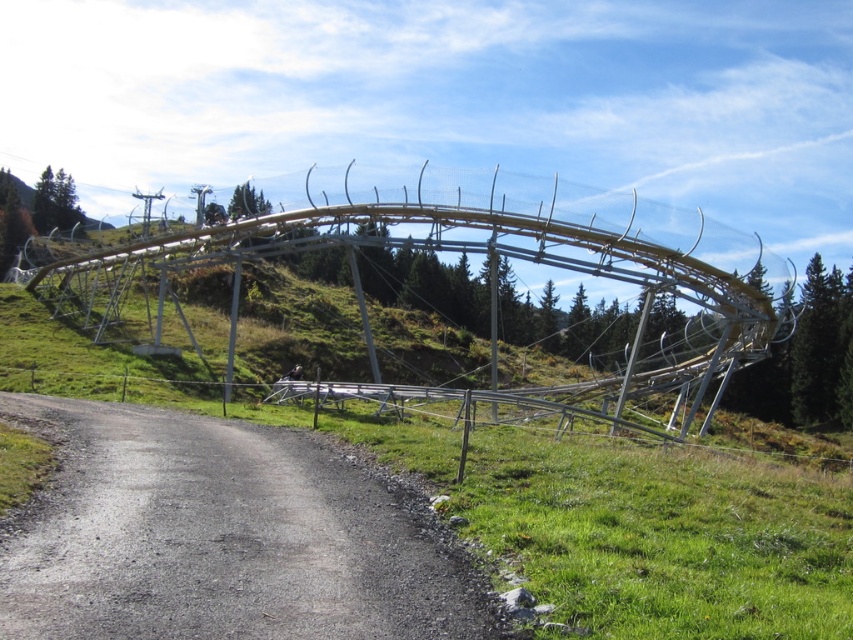
You are standing at the base of the roller coaster structure and want to reach a specific point marked as point (22, 529). If your walking speed is 1.5 meters per second, how many seconds will it take you to reach that point?

The point (22, 529) is 13.72 meters away from the viewer. At a walking speed of 1.5 meters per second, it would take approximately 9.15 seconds to reach the point.

You are standing at the center of the image and want to find the gray asphalt road at lower left. In which direction should you look to see it?

You should look to the lower left direction to see the gray asphalt road at lower left since its 2D location is at point (218,538).

You are a visitor at an amusement park and want to take a photo of the metallic silver roller coaster at center from the gray asphalt road at lower left. Is the road between you and the roller coaster, or behind it?

The gray asphalt road at lower left is in front of the metallic silver roller coaster at center, so if you are standing on the road, the roller coaster would be behind it. To take a photo of the roller coaster from the road, you would need to position yourself such that the road is between you and the roller coaster.